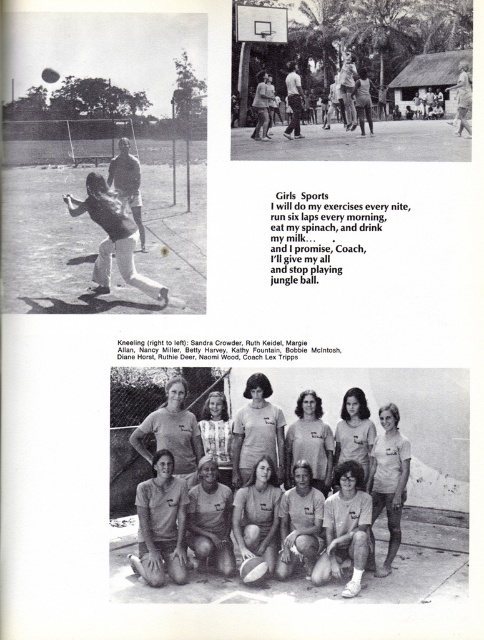
Question: Which object is farther from the camera taking this photo?

Choices:
 (A) light gray uniform at center
 (B) smooth skin man at center
 (C) light brown leather jacket at center

Answer: (B)

Question: Can you confirm if light brown leather jacket at left is thinner than dark brown leather jacket at center?

Choices:
 (A) no
 (B) yes

Answer: (A)

Question: Is light gray uniform at center bigger than light brown leather jacket at center?

Choices:
 (A) no
 (B) yes

Answer: (A)

Question: Based on their relative distances, which object is farther from the smooth skin man at center?

Choices:
 (A) light brown hair at center
 (B) light brown t-shirt at center
 (C) dark brown leather jacket at center

Answer: (B)

Question: Where is light brown t-shirt at center located in relation to light brown leather jacket at center in the image?

Choices:
 (A) below
 (B) above

Answer: (A)

Question: Which point is farther to the camera?

Choices:
 (A) (269, 108)
 (B) (354, 440)
 (C) (119, 189)
 (D) (346, 54)

Answer: (D)